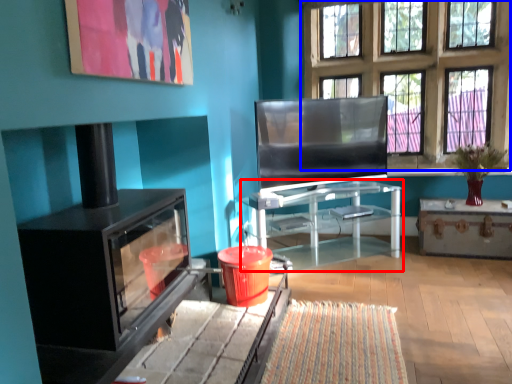
Question: Among these objects, which one is nearest to the camera, table (highlighted by a red box) or window (highlighted by a blue box)?

Choices:
 (A) table
 (B) window

Answer: (A)